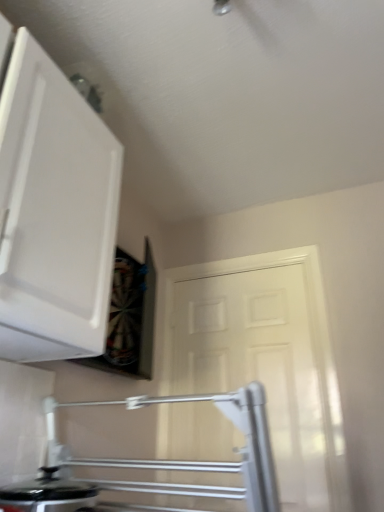
Question: Is black glossy pot at lower left further to the viewer compared to white matte cabinet at upper left?

Choices:
 (A) yes
 (B) no

Answer: (A)

Question: From a real-world perspective, is black glossy pot at lower left under white matte cabinet at upper left?

Choices:
 (A) yes
 (B) no

Answer: (A)

Question: Is black glossy pot at lower left positioned far away from white matte cabinet at upper left?

Choices:
 (A) no
 (B) yes

Answer: (A)

Question: Is white matte cabinet at upper left a part of black glossy pot at lower left?

Choices:
 (A) yes
 (B) no

Answer: (B)

Question: From a real-world perspective, does black glossy pot at lower left stand above white matte cabinet at upper left?

Choices:
 (A) yes
 (B) no

Answer: (B)

Question: Is white matte cabinet at upper left bigger or smaller than white matte door at center?

Choices:
 (A) small
 (B) big

Answer: (B)

Question: Considering the positions of white matte cabinet at upper left and white matte door at center in the image, is white matte cabinet at upper left taller or shorter than white matte door at center?

Choices:
 (A) tall
 (B) short

Answer: (B)

Question: From the image's perspective, is white matte cabinet at upper left located above or below white matte door at center?

Choices:
 (A) above
 (B) below

Answer: (A)

Question: Would you say white matte cabinet at upper left is inside or outside white matte door at center?

Choices:
 (A) outside
 (B) inside

Answer: (A)

Question: In terms of height, does black glossy pot at lower left look taller or shorter compared to white matte door at center?

Choices:
 (A) short
 (B) tall

Answer: (A)

Question: From the image's perspective, is black glossy pot at lower left above or below white matte door at center?

Choices:
 (A) above
 (B) below

Answer: (B)

Question: Visually, is black glossy pot at lower left positioned to the left or to the right of white matte door at center?

Choices:
 (A) left
 (B) right

Answer: (A)

Question: In terms of size, does black glossy pot at lower left appear bigger or smaller than white matte door at center?

Choices:
 (A) small
 (B) big

Answer: (A)

Question: Considering their positions, is white matte door at center located in front of or behind black glossy pot at lower left?

Choices:
 (A) front
 (B) behind

Answer: (B)

Question: Is point (258, 278) closer or farther from the camera than point (48, 488)?

Choices:
 (A) closer
 (B) farther

Answer: (B)